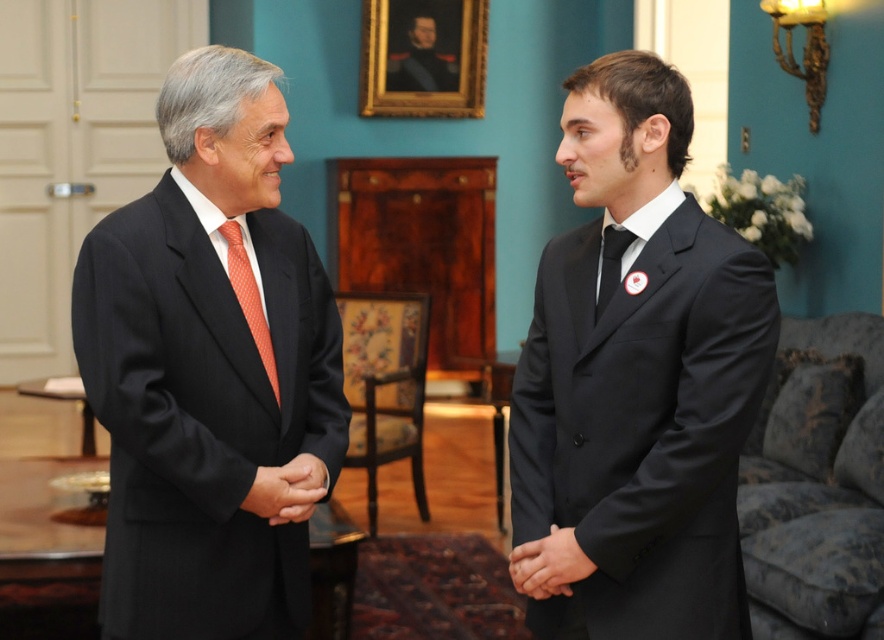
What are the coordinates of the matte black suit at center?

The coordinates of the matte black suit at center are at point (208,365).

What are the coordinates of the black satin suit at right?

The coordinates of the black satin suit at right are 0.588 on the x axis and 0.724 on the y axis.

You are a fashion designer observing the two individuals in the formal setting. You notice the matte black suit at center and the black satin tie at center. Which of these items is positioned lower on the person?

The matte black suit at center is positioned below the black satin tie at center, so the matte black suit at center is lower.